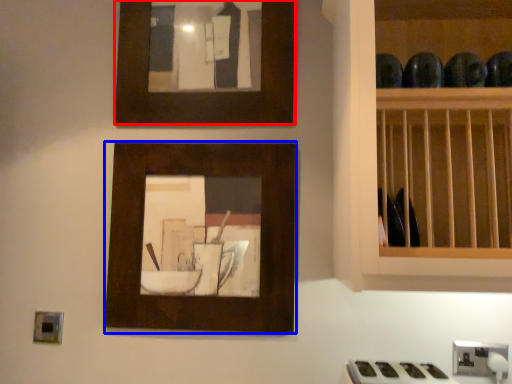
Question: Which point is further to the camera, picture frame (highlighted by a red box) or picture frame (highlighted by a blue box)?

Choices:
 (A) picture frame
 (B) picture frame

Answer: (A)